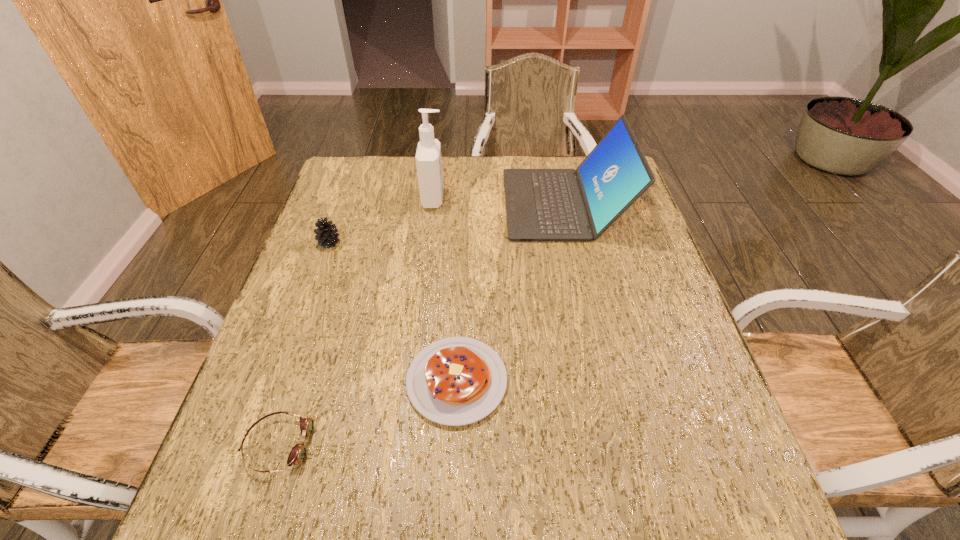
Where is `the tallest object`? This screenshot has width=960, height=540. the tallest object is located at coordinates (428, 155).

Where is `the fourth shortest object`? the fourth shortest object is located at coordinates (541, 204).

You are a GUI agent. You are given a task and a screenshot of the screen. Output one action in this format:
    pyautogui.click(x=<x>, y=<y>)
    Task: Click on the rightmost object
    This screenshot has width=960, height=540.
    Given the screenshot: What is the action you would take?
    pyautogui.click(x=541, y=204)

Identify the location of pinecone. (326, 234).

What are the coordinates of `pancake` in the screenshot? It's located at (454, 381).

I want to click on the shortest object, so click(297, 455).

Image resolution: width=960 pixels, height=540 pixels. I want to click on vacant space situated on the front label of the cleansing agent, so click(516, 199).

The height and width of the screenshot is (540, 960). In order to click on free spot located on the screen of the laptop computer in this screenshot , I will do `click(462, 204)`.

Identify the location of free region located on the screen of the laptop computer. This screenshot has height=540, width=960. click(x=428, y=204).

The height and width of the screenshot is (540, 960). Find the location of `free space located 0.150m on the screen of the laptop computer`. free space located 0.150m on the screen of the laptop computer is located at coordinates (455, 204).